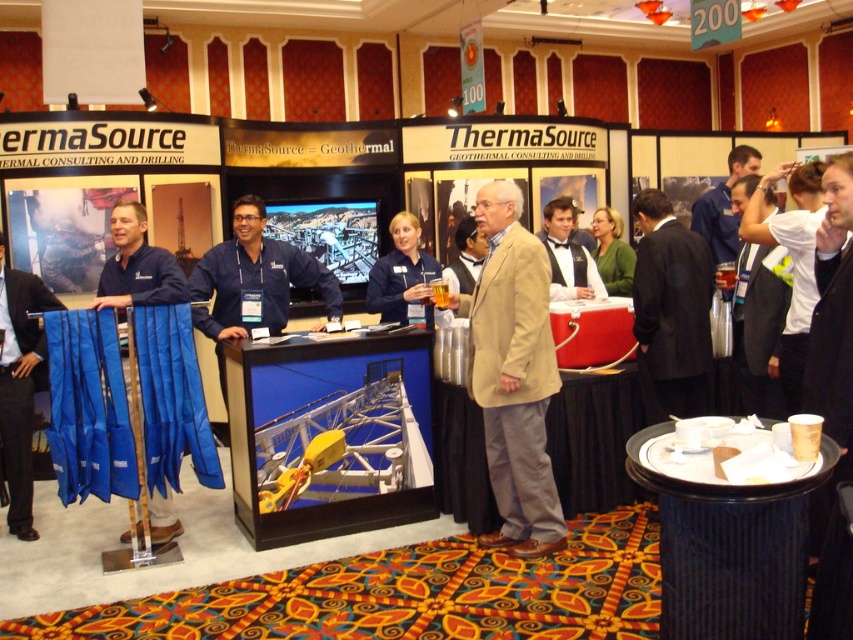
You are a visitor at the ThermaSource booth. You notice two people in the booth. One is wearing a black suit at right and the other is in a blue uniform at center. Which person is standing closer to the counter where you can ask questions?

The black suit at right is located below the blue uniform at center, which suggests the person in the black suit at right is closer to the counter. Therefore, you should approach the black suit at right.

Looking at this image, you are standing at the ThermaSource booth and notice two people in different attire. The blue uniform at center and the light brown suit at center are both visible. Can you determine if there is enough space between them to walk through comfortably? Please consider the average shoulder width of a person is about 18 inches.

The blue uniform at center and the light brown suit at center are 32.97 inches apart from each other, which is more than enough space to walk through comfortably since the average shoulder width is about 18 inches.